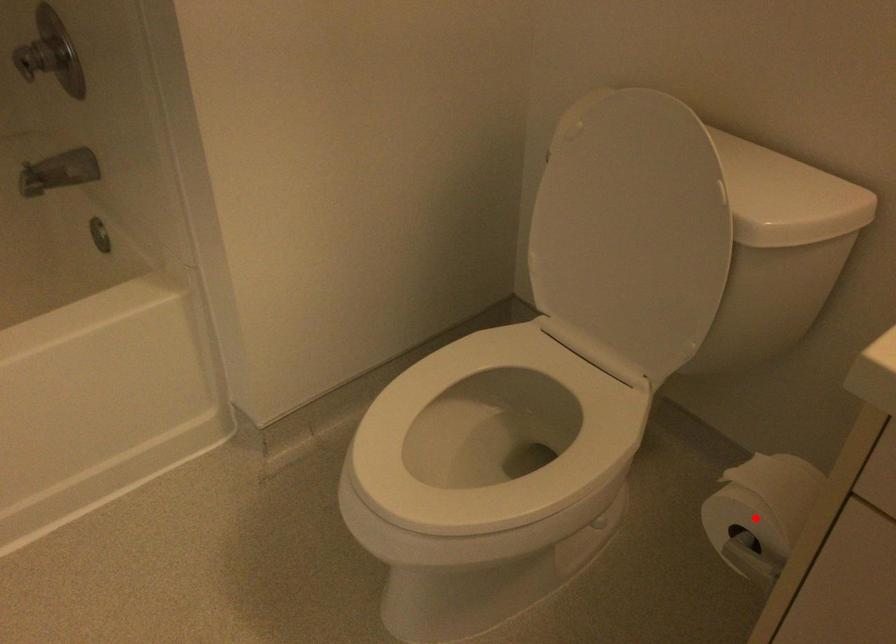
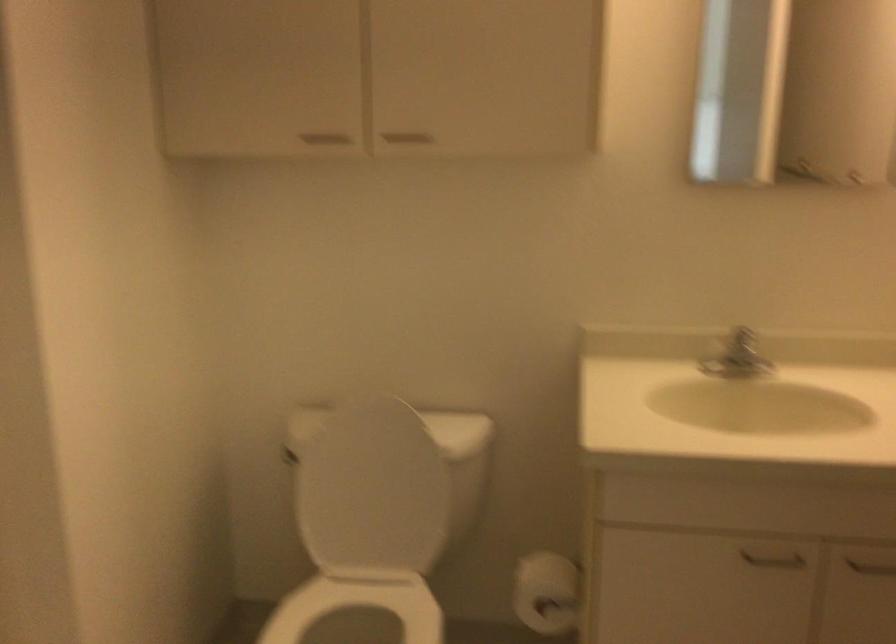
Locate, in the second image, the point that corresponds to the highlighted location in the first image.

(547, 592)